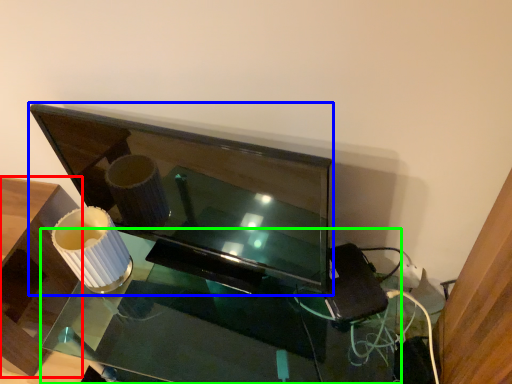
Question: Estimate the real-world distances between objects in this image. Which object is closer to furniture (highlighted by a red box), television (highlighted by a blue box) or table (highlighted by a green box)?

Choices:
 (A) television
 (B) table

Answer: (B)